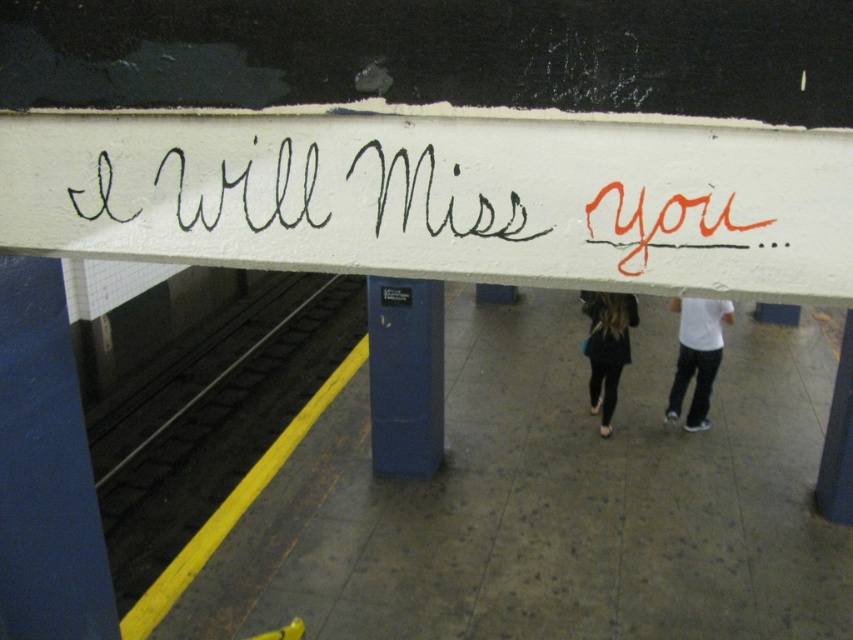
Question: Considering the real-world distances, which object is farthest from the blue metallic pillar at center?

Choices:
 (A) black handwritten text at upper center
 (B) white matte shirt at center
 (C) black leather pants at center

Answer: (A)

Question: Which point appears closest to the camera in this image?

Choices:
 (A) (614, 358)
 (B) (254, 422)

Answer: (A)

Question: Does yellow rubber at bottom left have a larger size compared to blue metallic pillar at center?

Choices:
 (A) no
 (B) yes

Answer: (A)

Question: Does white painted graffiti at upper center have a larger size compared to black leather pants at center?

Choices:
 (A) yes
 (B) no

Answer: (B)

Question: Can you confirm if blue metallic pillar at center is positioned to the right of white matte shirt at center?

Choices:
 (A) yes
 (B) no

Answer: (B)

Question: Which point is closer to the camera taking this photo?

Choices:
 (A) (717, 150)
 (B) (601, 387)

Answer: (A)